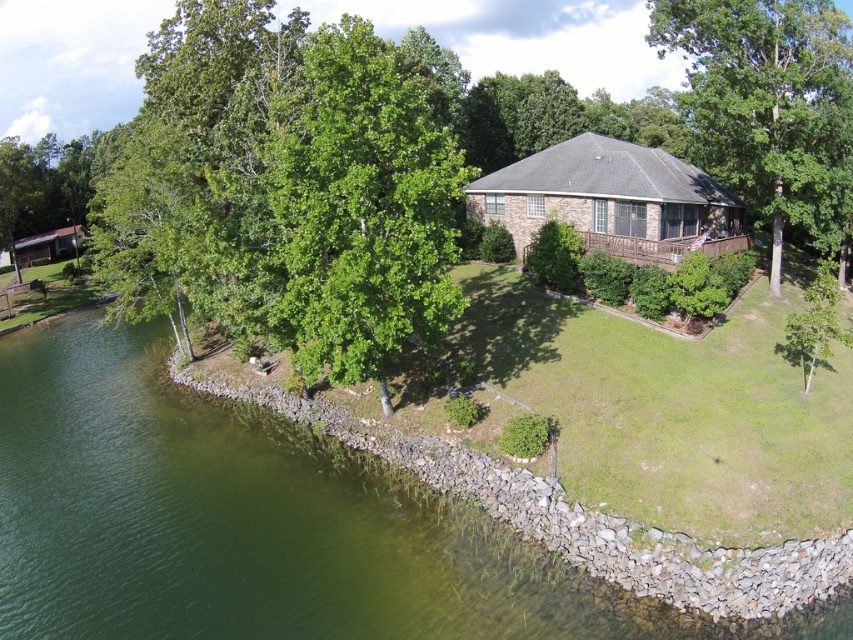
Which of these two, green leafy tree at upper right or matte brown cottage at lower left, stands shorter?

matte brown cottage at lower left is shorter.

Does green leafy tree at upper right appear under matte brown cottage at lower left?

Actually, green leafy tree at upper right is above matte brown cottage at lower left.

Where is `green leafy tree at upper right`? The width and height of the screenshot is (853, 640). green leafy tree at upper right is located at coordinates (769, 106).

Does green water at lower left have a larger size compared to green leafy tree at upper right?

No.

How distant is green water at lower left from green leafy tree at upper right?

They are 85.58 feet apart.

Does point (260, 504) come behind point (676, 40)?

No, it is not.

The image size is (853, 640). I want to click on green water at lower left, so [258, 524].

Who is more forward, (x=96, y=618) or (x=525, y=237)?

Point (x=96, y=618) is more forward.

Does point (16, 472) come farther from viewer compared to point (589, 234)?

No, (16, 472) is closer to viewer.

Is point (115, 550) in front of point (641, 227)?

Yes, it is.

This screenshot has height=640, width=853. I want to click on green water at lower left, so click(258, 524).